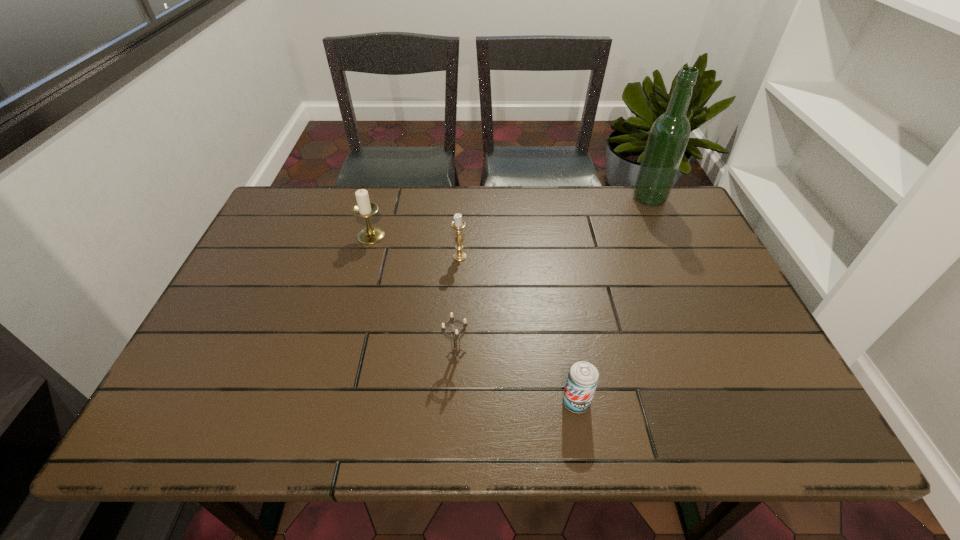
Locate an element on the screen. empty location between the rightmost object and the second nearest object is located at coordinates (553, 276).

Locate an element on the screen. This screenshot has height=540, width=960. vacant region between the fourth object from left to right and the rightmost object is located at coordinates (612, 300).

Where is `free space between the shortest candle holder and the third nearest object`? This screenshot has height=540, width=960. free space between the shortest candle holder and the third nearest object is located at coordinates (458, 306).

Identify the location of empty location between the leftmost object and the beer can. (473, 319).

Where is `free area in between the shortest candle holder and the second nearest candle holder`? free area in between the shortest candle holder and the second nearest candle holder is located at coordinates (458, 306).

Find the location of a particular element. The width and height of the screenshot is (960, 540). free space between the third farthest object and the second nearest object is located at coordinates (458, 306).

Choose which object is the third nearest neighbor to the fourth object from left to right. Please provide its 2D coordinates. Your answer should be formatted as a tuple, i.e. [(x, y)], where the tuple contains the x and y coordinates of a point satisfying the conditions above.

[(364, 208)]

What are the coordinates of `the fourth closest object relative to the fourth object from left to right` in the screenshot? It's located at (669, 134).

The width and height of the screenshot is (960, 540). What are the coordinates of `candle holder that is the nearest to the second nearest candle holder` in the screenshot? It's located at (364, 208).

This screenshot has height=540, width=960. In order to click on the second closest candle holder to the second nearest object in this screenshot , I will do `click(364, 208)`.